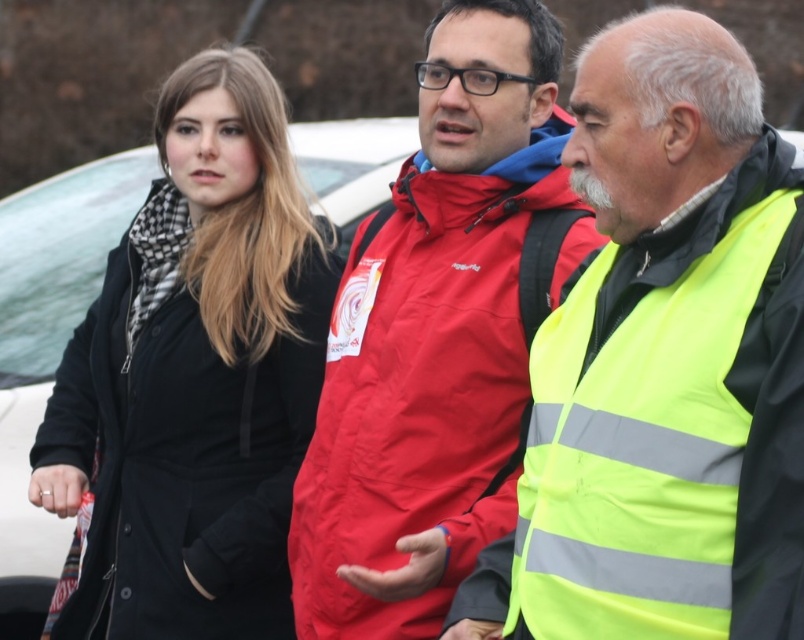
Question: Which of the following is the farthest from the observer?

Choices:
 (A) (649, 74)
 (B) (497, 81)

Answer: (B)

Question: Estimate the real-world distances between objects in this image. Which object is closer to the reflective yellow vest at right?

Choices:
 (A) red matte jacket at center
 (B) black matte coat at left

Answer: (A)

Question: Which point is closer to the camera?

Choices:
 (A) reflective yellow vest at right
 (B) black matte coat at left
 (C) red matte jacket at center

Answer: (A)

Question: Is reflective yellow vest at right above red matte jacket at center?

Choices:
 (A) no
 (B) yes

Answer: (A)

Question: Does reflective yellow vest at right appear over black matte coat at left?

Choices:
 (A) no
 (B) yes

Answer: (B)

Question: Does reflective yellow vest at right have a greater width compared to red matte jacket at center?

Choices:
 (A) yes
 (B) no

Answer: (B)